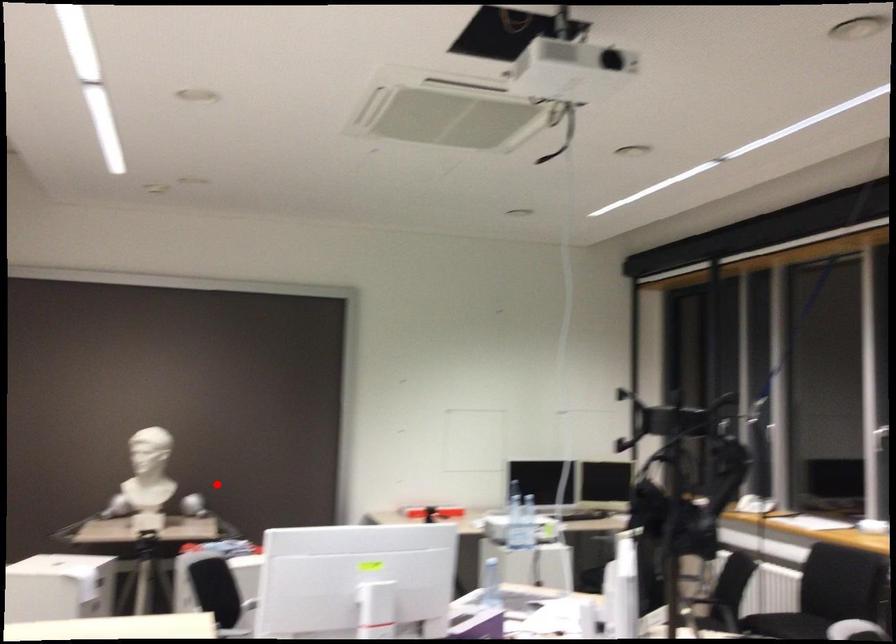
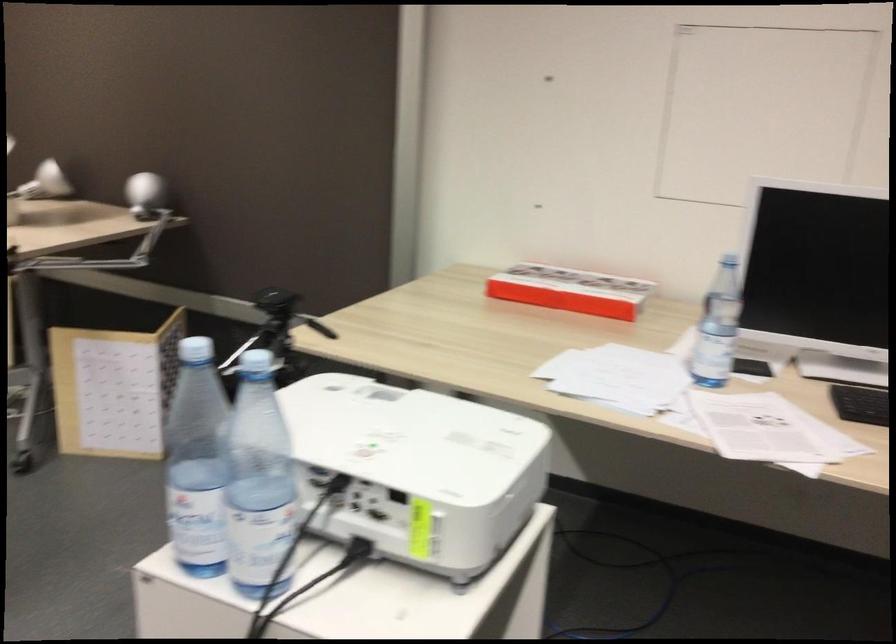
The point at the highlighted location is marked in the first image. Where is the corresponding point in the second image?

(143, 194)